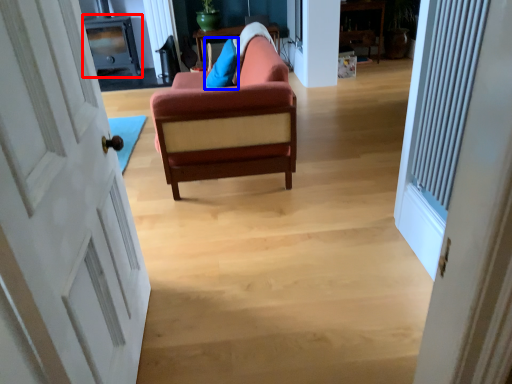
Question: Among these objects, which one is nearest to the camera, entertainment center (highlighted by a red box) or pillow (highlighted by a blue box)?

Choices:
 (A) entertainment center
 (B) pillow

Answer: (B)